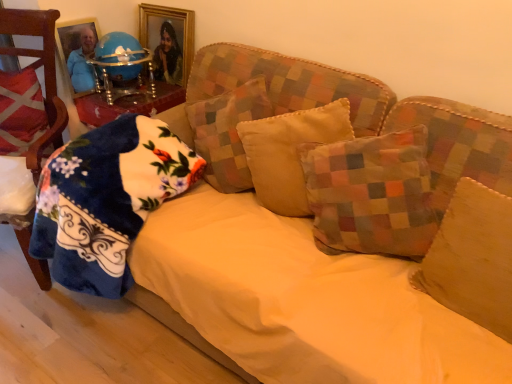
Question: Which direction should I rotate to look at patchwork fabric pillow at center, the 4th pillow viewed from the right, — up or down?

Choices:
 (A) up
 (B) down

Answer: (A)

Question: From a real-world perspective, is velvet red chair at left beneath gold-framed picture at upper center?

Choices:
 (A) yes
 (B) no

Answer: (A)

Question: Is velvet red chair at left to the right of gold-framed picture at upper center from the viewer's perspective?

Choices:
 (A) no
 (B) yes

Answer: (A)

Question: Can you confirm if velvet red chair at left is taller than gold-framed picture at upper center?

Choices:
 (A) yes
 (B) no

Answer: (A)

Question: Can we say velvet red chair at left lies outside gold-framed picture at upper center?

Choices:
 (A) no
 (B) yes

Answer: (B)

Question: Could you tell me if velvet red chair at left is facing gold-framed picture at upper center?

Choices:
 (A) no
 (B) yes

Answer: (A)

Question: Does velvet red chair at left have a lesser height compared to gold-framed picture at upper center?

Choices:
 (A) no
 (B) yes

Answer: (A)

Question: Can you confirm if fluffy blue blanket at left, which is the fifth pillow in right-to-left order, is positioned to the left of yellow fabric sheet at center?

Choices:
 (A) no
 (B) yes

Answer: (B)

Question: Would you say fluffy blue blanket at left, which is the fifth pillow in right-to-left order, contains yellow fabric sheet at center?

Choices:
 (A) yes
 (B) no

Answer: (B)

Question: Is fluffy blue blanket at left, the second pillow in the left-to-right sequence, facing away from yellow fabric sheet at center?

Choices:
 (A) no
 (B) yes

Answer: (B)

Question: From the image's perspective, is fluffy blue blanket at left, the second pillow in the left-to-right sequence, located beneath yellow fabric sheet at center?

Choices:
 (A) yes
 (B) no

Answer: (B)

Question: Is fluffy blue blanket at left, the second pillow in the left-to-right sequence, not inside yellow fabric sheet at center?

Choices:
 (A) yes
 (B) no

Answer: (B)

Question: Is fluffy blue blanket at left, which is the fifth pillow in right-to-left order, in front of yellow fabric sheet at center?

Choices:
 (A) no
 (B) yes

Answer: (A)

Question: Considering the relative sizes of patchwork fabric pillow at center, positioned as the 3th pillow in left-to-right order, and gold-framed picture at upper center in the image provided, is patchwork fabric pillow at center, positioned as the 3th pillow in left-to-right order, smaller than gold-framed picture at upper center?

Choices:
 (A) yes
 (B) no

Answer: (B)